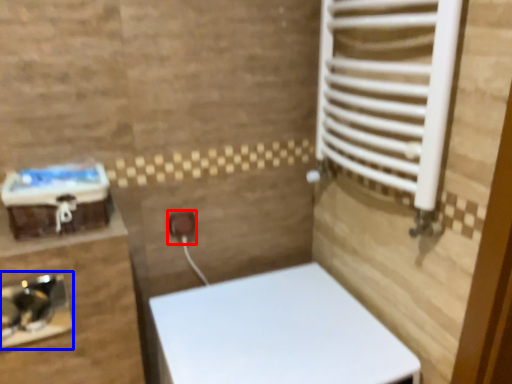
Question: Which object appears farthest to the camera in this image, electric outlet (highlighted by a red box) or sink (highlighted by a blue box)?

Choices:
 (A) electric outlet
 (B) sink

Answer: (A)